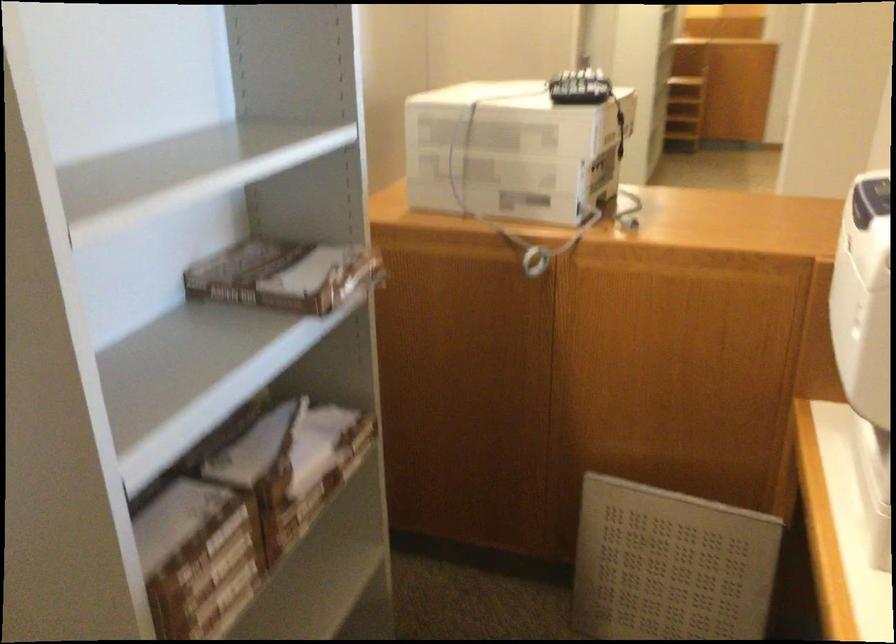
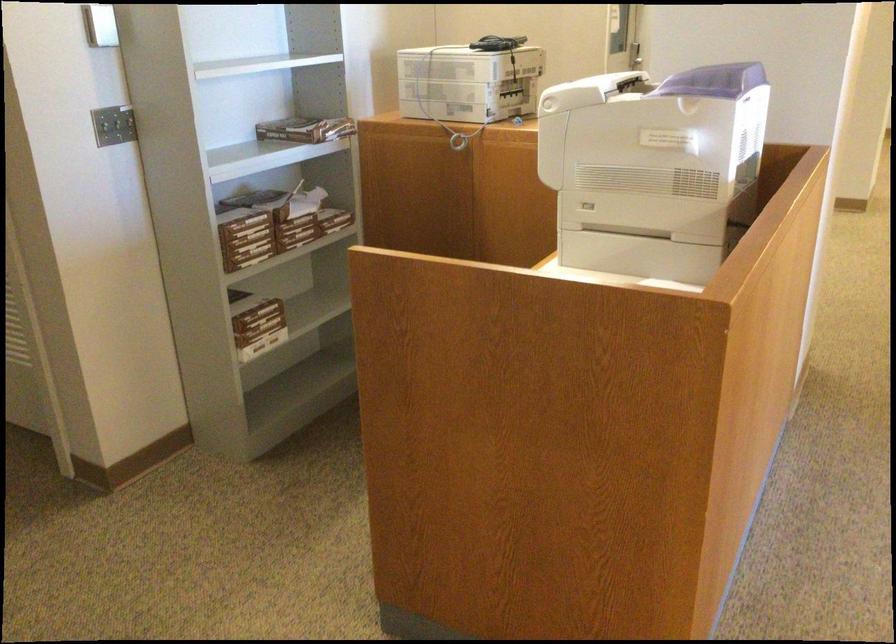
Where in the second image is the point corresponding to (304,518) from the first image?

(297, 231)